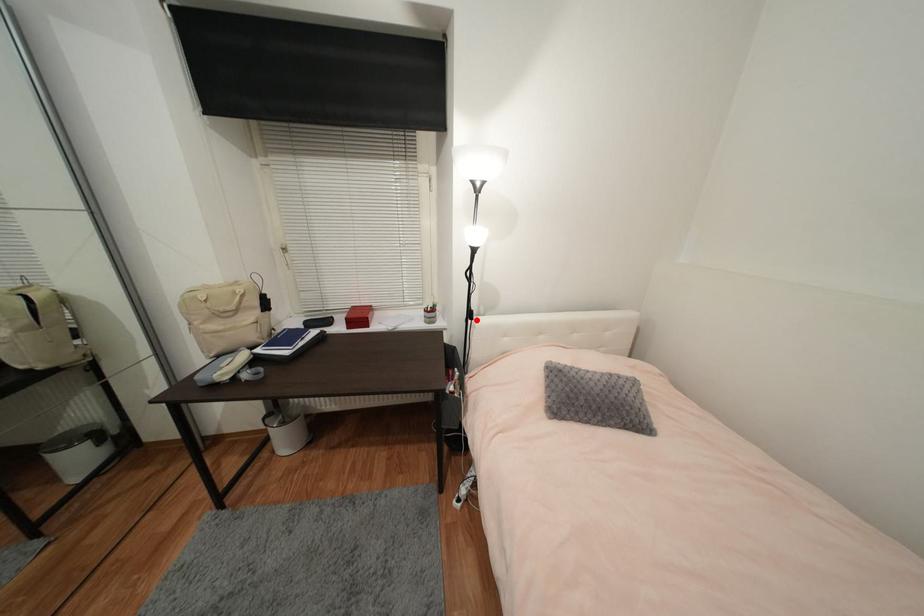
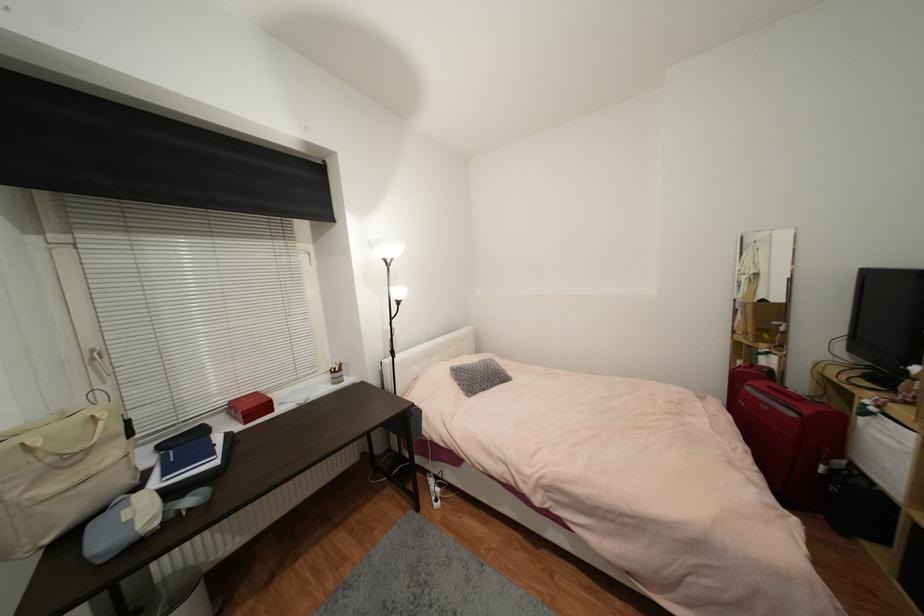
In the second image, find the point that corresponds to the highlighted location in the first image.

(398, 358)